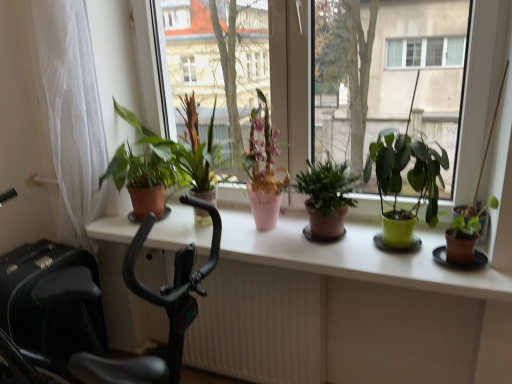
You are a GUI agent. You are given a task and a screenshot of the screen. Output one action in this format:
    pyautogui.click(x=<x>, y=<y>)
    Task: Click on the free space in front of green matte plant at center, which is the 4th houseplant in left-to-right order
    
    Given the screenshot: What is the action you would take?
    pyautogui.click(x=415, y=268)